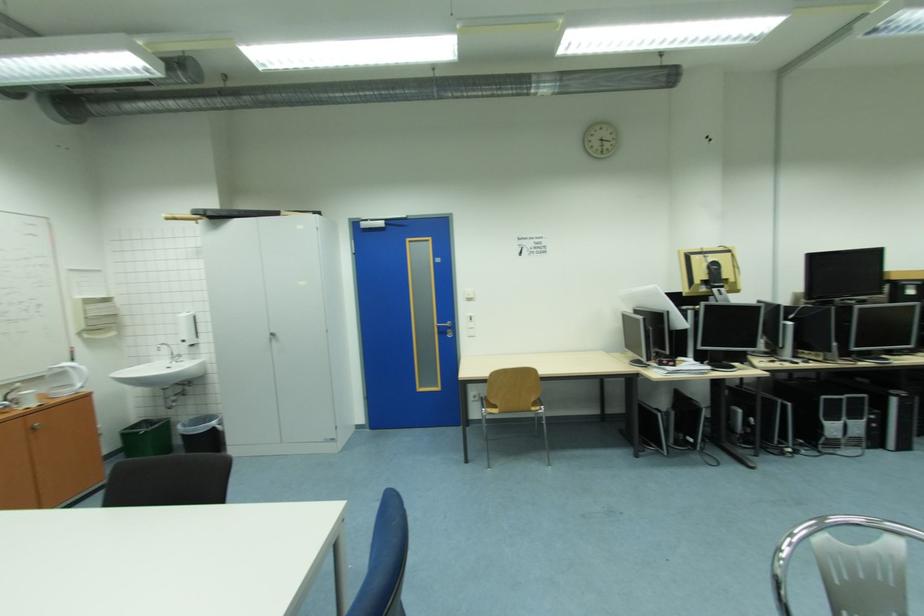
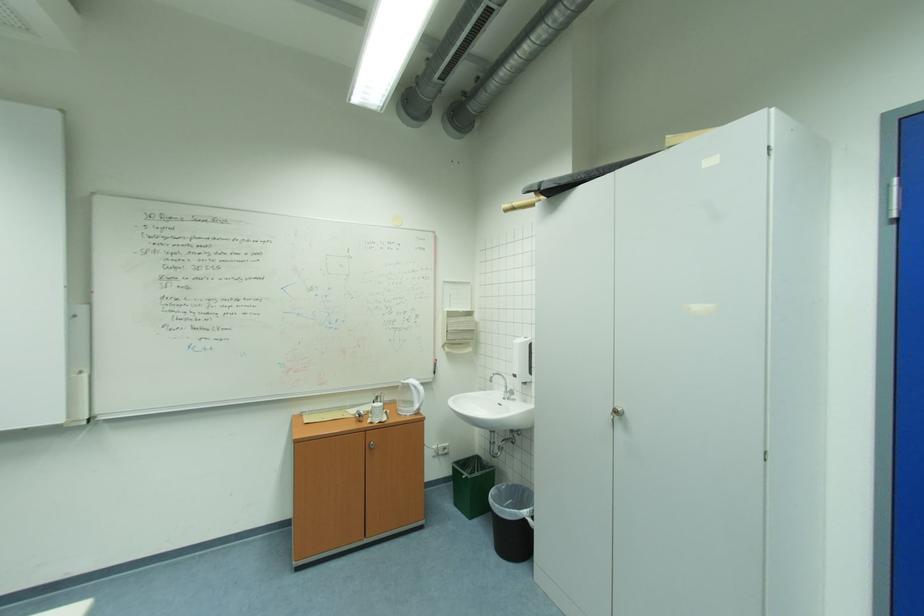
Locate, in the second image, the point that corresponds to the point at 220,424 in the first image.

(532, 513)